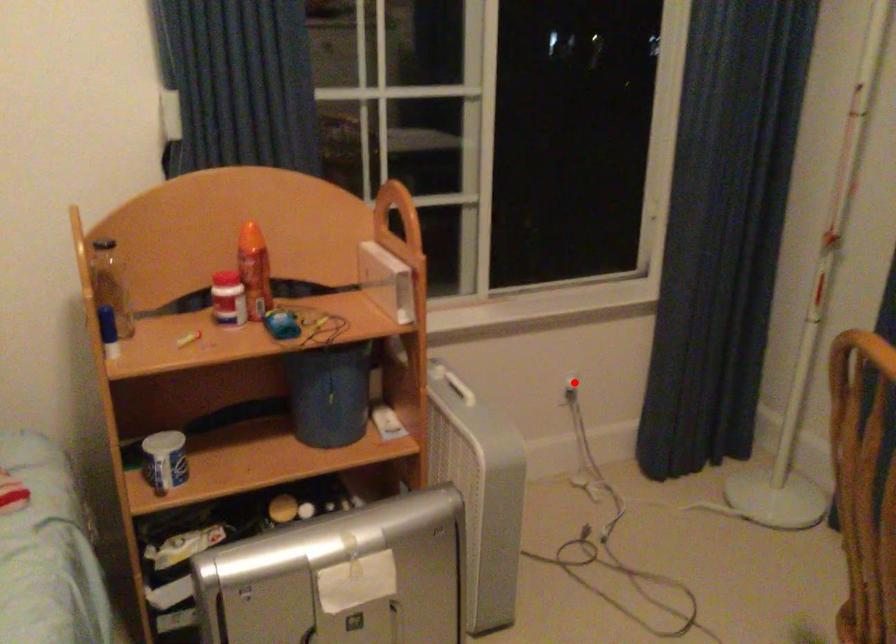
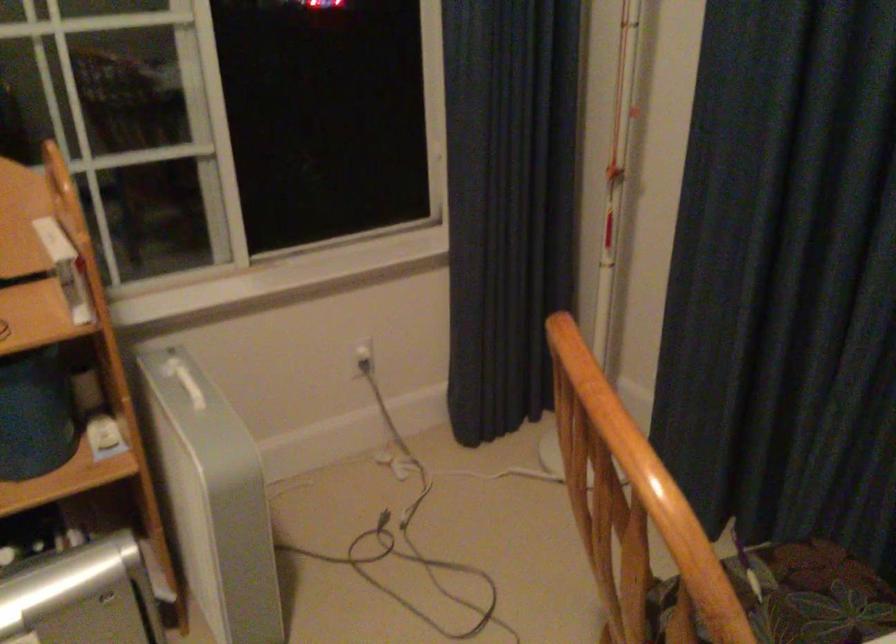
The point at the highlighted location is marked in the first image. Where is the corresponding point in the second image?

(363, 355)